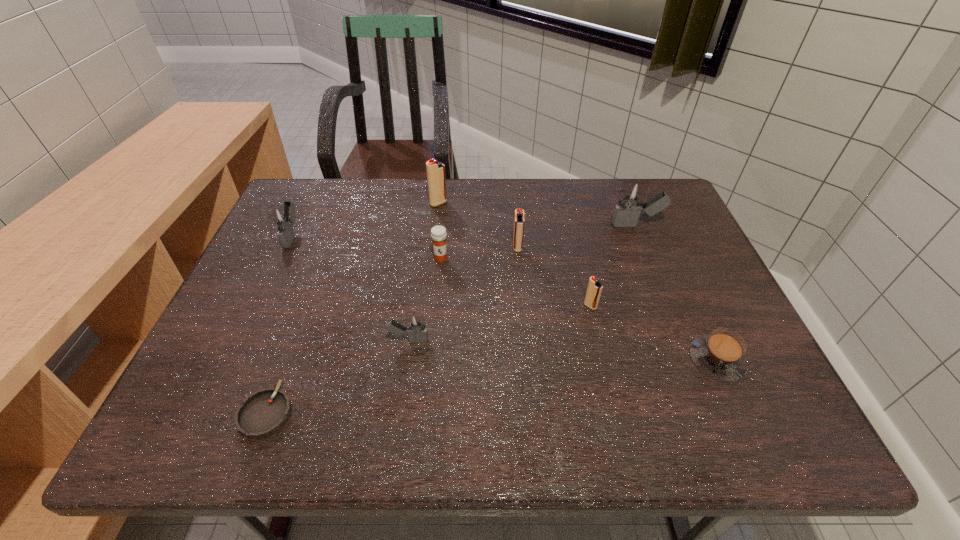
Identify which igniter is located as the third nearest to the farthest red igniter. Please provide its 2D coordinates. Your answer should be formatted as a tuple, i.e. [(x, y)], where the tuple contains the x and y coordinates of a point satisfying the conditions above.

[(416, 329)]

In order to click on red igniter that is the third closest to the rightmost igniter in this screenshot , I will do `click(436, 179)`.

Identify the location of red igniter that can be found as the second closest to the fifth igniter from left to right. 436,179.

Where is `gray igniter that stands as the closest to the second biggest gray igniter`? gray igniter that stands as the closest to the second biggest gray igniter is located at coordinates (416, 329).

Identify the location of gray igniter that is the second nearest to the leftmost object. (631, 198).

Find the location of a particular element. The image size is (960, 540). blank space that satisfies the following two spatial constraints: 1. on the back side of the second object from left to right; 2. on the right side of the seventh object from left to right is located at coordinates (305, 306).